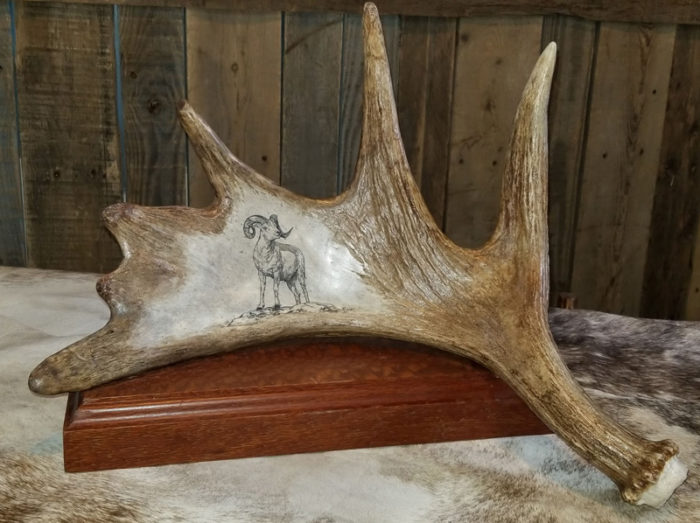
This screenshot has width=700, height=523. I want to click on wooden base, so click(265, 394).